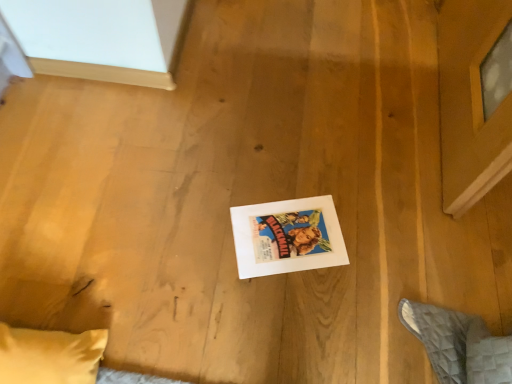
Identify the location of vacant space to the right of white paper at center. Image resolution: width=512 pixels, height=384 pixels. (373, 243).